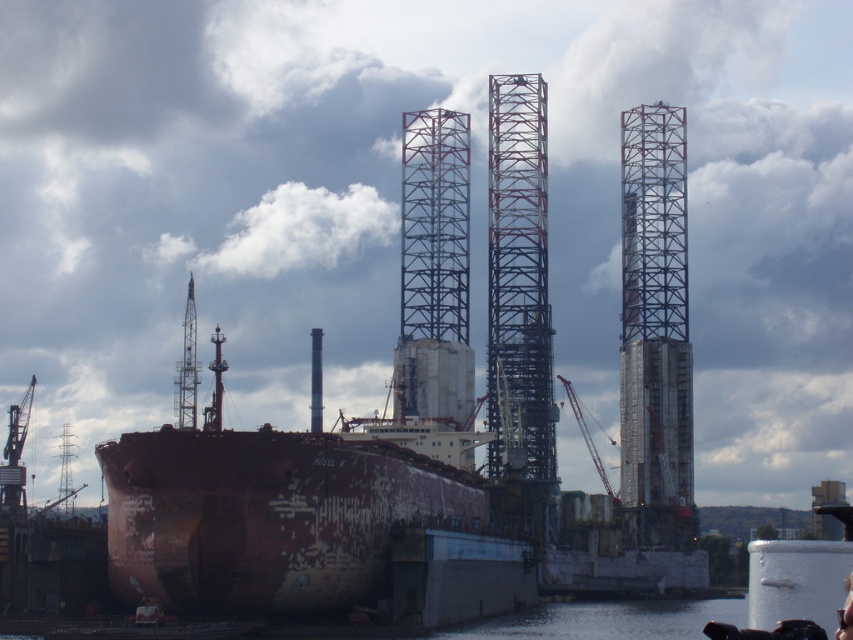
Can you confirm if clear water at lower center is taller than rusty metal crane at center?

No.

Is point (691, 616) farther from viewer compared to point (184, 320)?

No, (691, 616) is closer to viewer.

Where is `clear water at lower center`? This screenshot has width=853, height=640. clear water at lower center is located at coordinates (605, 620).

The height and width of the screenshot is (640, 853). In order to click on clear water at lower center in this screenshot , I will do `click(605, 620)`.

Which is more to the right, clear water at lower center or metallic gray crane at center?

metallic gray crane at center

Does clear water at lower center appear on the right side of metallic gray crane at center?

In fact, clear water at lower center is to the left of metallic gray crane at center.

This screenshot has width=853, height=640. What do you see at coordinates (605, 620) in the screenshot? I see `clear water at lower center` at bounding box center [605, 620].

What are the coordinates of `clear water at lower center` in the screenshot? It's located at (x=605, y=620).

The image size is (853, 640). What do you see at coordinates (187, 368) in the screenshot?
I see `rusty metal crane at center` at bounding box center [187, 368].

Can you confirm if rusty metal crane at center is positioned above metallic gray crane at center?

Correct, rusty metal crane at center is located above metallic gray crane at center.

Does point (190, 301) lie behind point (585, 440)?

That is False.

Find the location of a particular element. This screenshot has width=853, height=640. rusty metal crane at center is located at coordinates (187, 368).